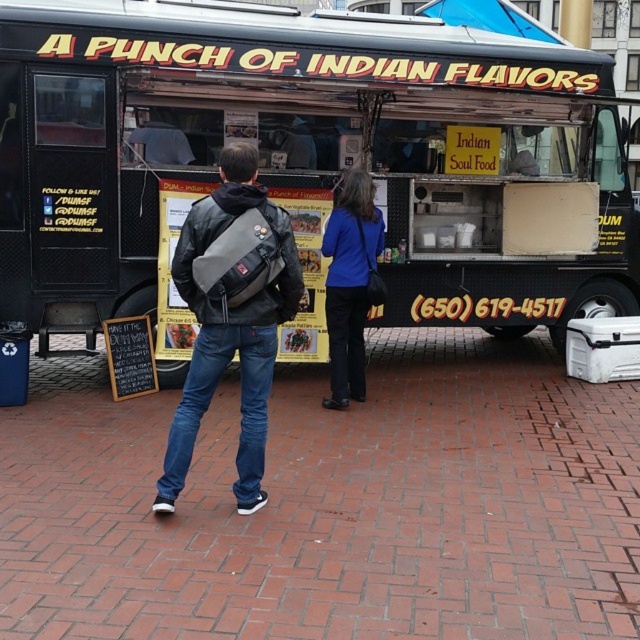
Question: Does matte plastic cupcake at center have a larger size compared to matte yellow menu at center?

Choices:
 (A) yes
 (B) no

Answer: (B)

Question: Is blue fabric canopy at upper center to the left of matte yellow menu at center from the viewer's perspective?

Choices:
 (A) no
 (B) yes

Answer: (A)

Question: Is leather jacket at center wider than matte plastic cupcake at center?

Choices:
 (A) yes
 (B) no

Answer: (A)

Question: Based on their relative distances, which object is farther from the leather jacket at center?

Choices:
 (A) matte brown curry at center
 (B) matte black menu board at center
 (C) black matte food truck at center
 (D) matte yellow menu at center

Answer: (C)

Question: Which object is positioned closest to the matte yellow menu at center?

Choices:
 (A) matte brown curry at center
 (B) brick pavement at center
 (C) blue fabric jacket at center

Answer: (A)

Question: Which point is farther from the camera taking this photo?

Choices:
 (A) (291, 348)
 (B) (109, 419)
 (C) (362, 305)

Answer: (A)